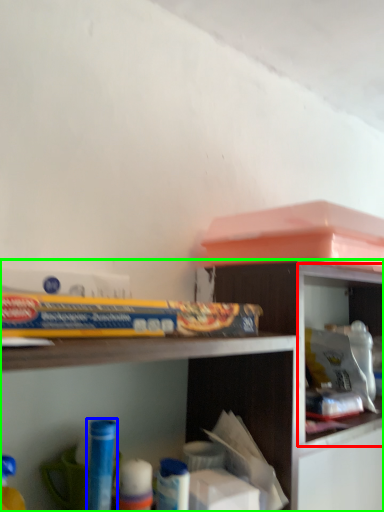
Question: Which object is positioned farthest from cabinet (highlighted by a red box)? Select from toy (highlighted by a blue box) and shelf (highlighted by a green box).

Choices:
 (A) toy
 (B) shelf

Answer: (A)